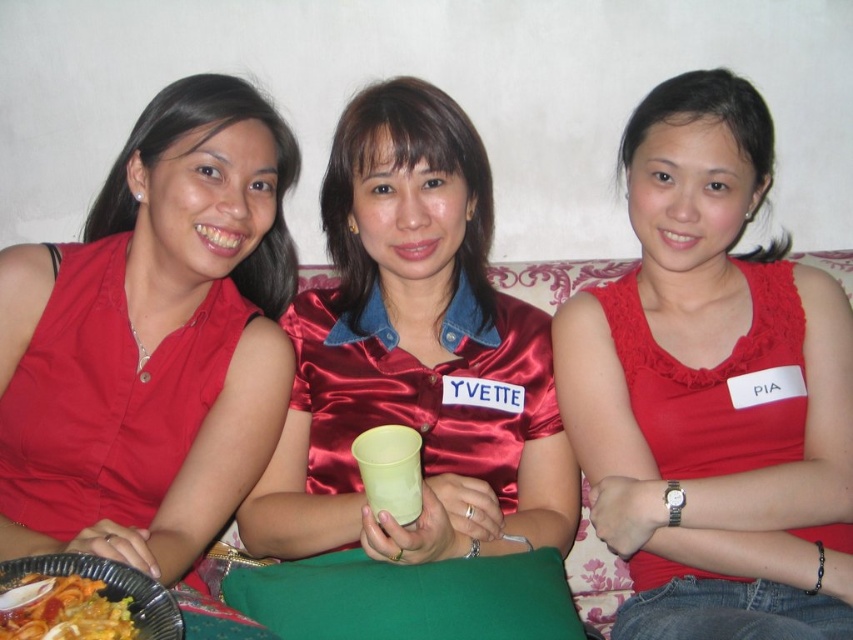
Question: Does matte red dress at center lie behind yellow matte cup at center?

Choices:
 (A) no
 (B) yes

Answer: (A)

Question: Which point is closer to the camera?

Choices:
 (A) yellow matte cup at center
 (B) matte red dress at left
 (C) matte red dress at center

Answer: (C)

Question: Which point is closer to the camera?

Choices:
 (A) matte red dress at left
 (B) yellow matte cup at center

Answer: (B)

Question: Which of these objects is positioned closest to the matte red dress at left?

Choices:
 (A) yellow matte cup at center
 (B) yellow matte cup at lower left
 (C) satin red dress at center
 (D) matte red dress at center

Answer: (C)

Question: Does matte red dress at left have a lesser width compared to yellow matte cup at lower left?

Choices:
 (A) no
 (B) yes

Answer: (A)

Question: Where is matte red dress at center located in relation to yellow matte cup at lower left in the image?

Choices:
 (A) above
 (B) below

Answer: (A)